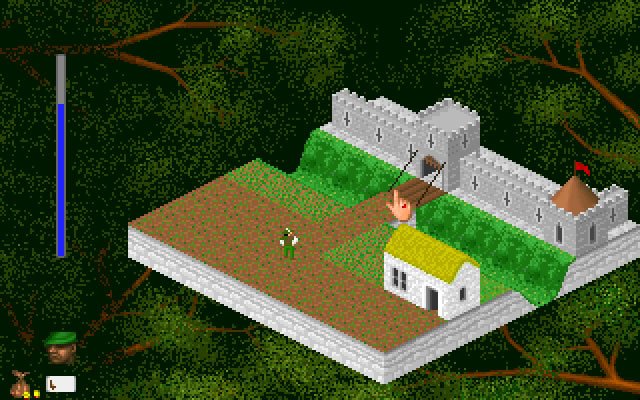
This screenshot has height=400, width=640. Find the location of `four pane window`. four pane window is located at coordinates (395, 276).